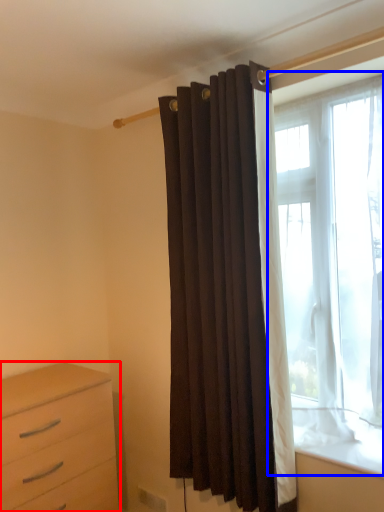
Question: Which object appears closest to the camera in this image, chest of drawers (highlighted by a red box) or window (highlighted by a blue box)?

Choices:
 (A) chest of drawers
 (B) window

Answer: (B)